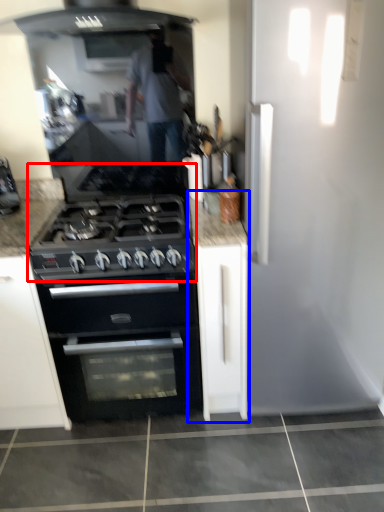
Question: Which of the following is the farthest to the observer, gas stove (highlighted by a red box) or cabinetry (highlighted by a blue box)?

Choices:
 (A) gas stove
 (B) cabinetry

Answer: (B)